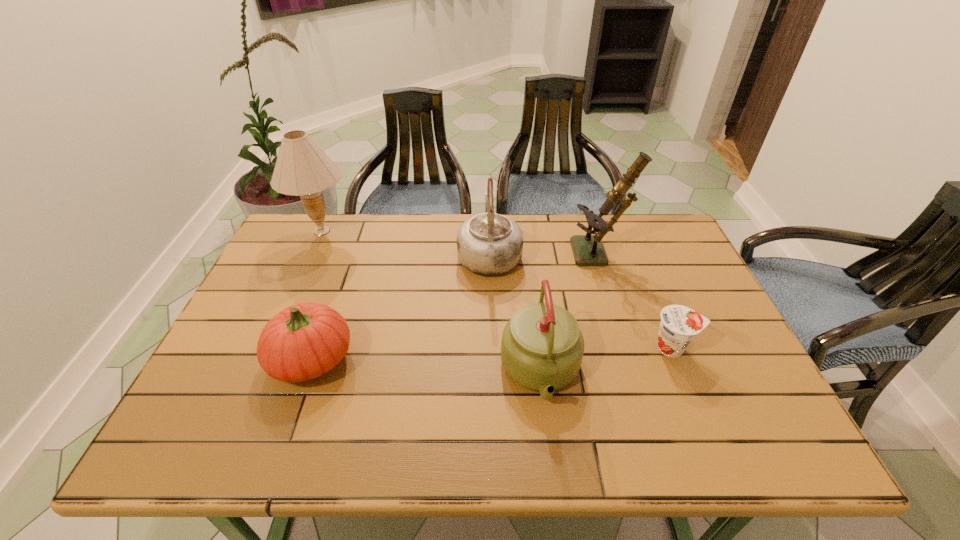
Identify the location of lampshade. (302, 168).

I want to click on microscope, so click(588, 249).

The width and height of the screenshot is (960, 540). Identify the location of the farther kettle. (489, 244).

Identify the location of the nearer kettle. This screenshot has width=960, height=540. (542, 347).

The image size is (960, 540). Identify the location of pumpkin. (302, 342).

The height and width of the screenshot is (540, 960). What are the coordinates of `yogurt` in the screenshot? It's located at (679, 324).

This screenshot has width=960, height=540. I want to click on vacant space located on the front of the lampshade, so click(x=284, y=315).

You are a GUI agent. You are given a task and a screenshot of the screen. Output one action in this format:
    pyautogui.click(x=<x>, y=<y>)
    Task: Click on the free space located at the eyepiece of the microscope
    
    Given the screenshot: What is the action you would take?
    pyautogui.click(x=520, y=255)

At what (x,y) coordinates should I click in order to perform the action: click on free space located at the eyepiece of the microscope. Please return your answer as a coordinate pair (x, y). Looking at the image, I should click on (452, 255).

Where is `vacant space positioned 0.250m at the eyepiece of the microscope`? vacant space positioned 0.250m at the eyepiece of the microscope is located at coordinates (492, 255).